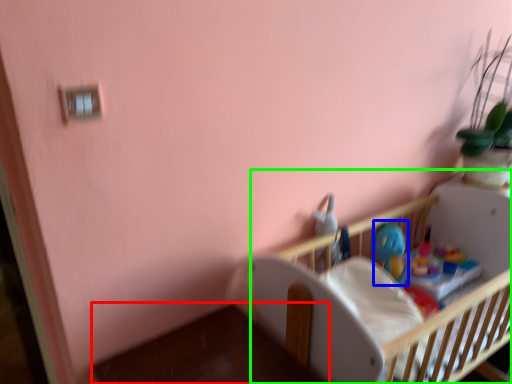
Question: Which object is positioned farthest from table (highlighted by a red box)? Select from toy (highlighted by a blue box) and infant bed (highlighted by a green box).

Choices:
 (A) toy
 (B) infant bed

Answer: (A)